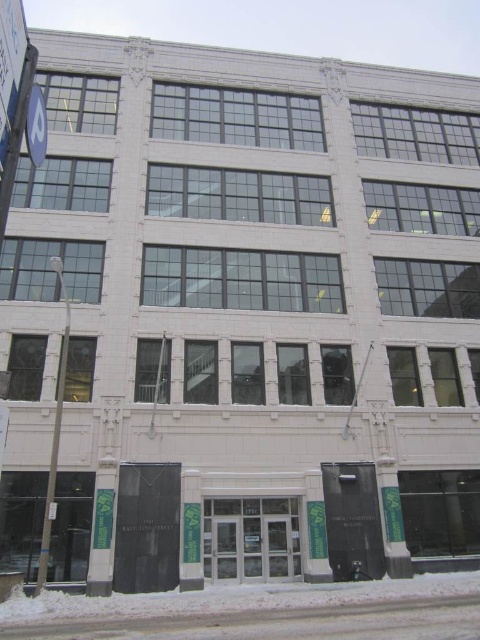
Is point (479, 586) farther from viewer compared to point (41, 134)?

Yes.

Does point (243, 604) come farther from viewer compared to point (41, 148)?

That is True.

Where is `white powdery snow at lower center`? This screenshot has height=640, width=480. white powdery snow at lower center is located at coordinates (233, 600).